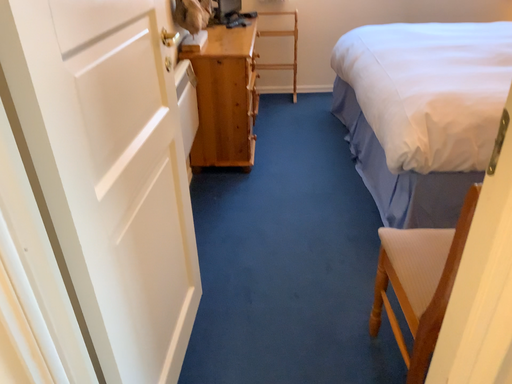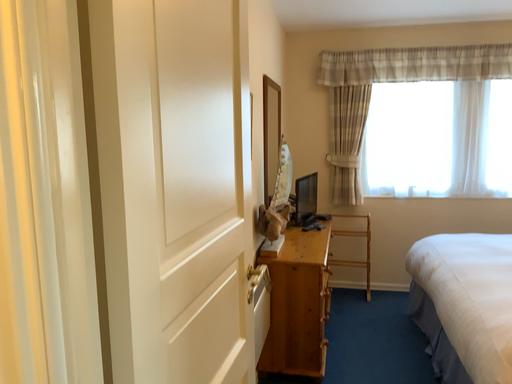
Question: How did the camera likely rotate when shooting the video?

Choices:
 (A) rotated upward
 (B) rotated downward

Answer: (A)